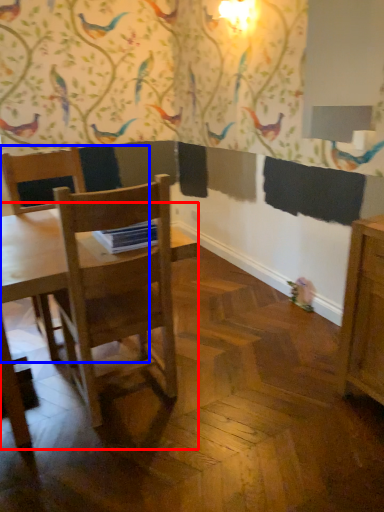
Question: Which point is further to the camera, table (highlighted by a red box) or chair (highlighted by a blue box)?

Choices:
 (A) table
 (B) chair

Answer: (B)